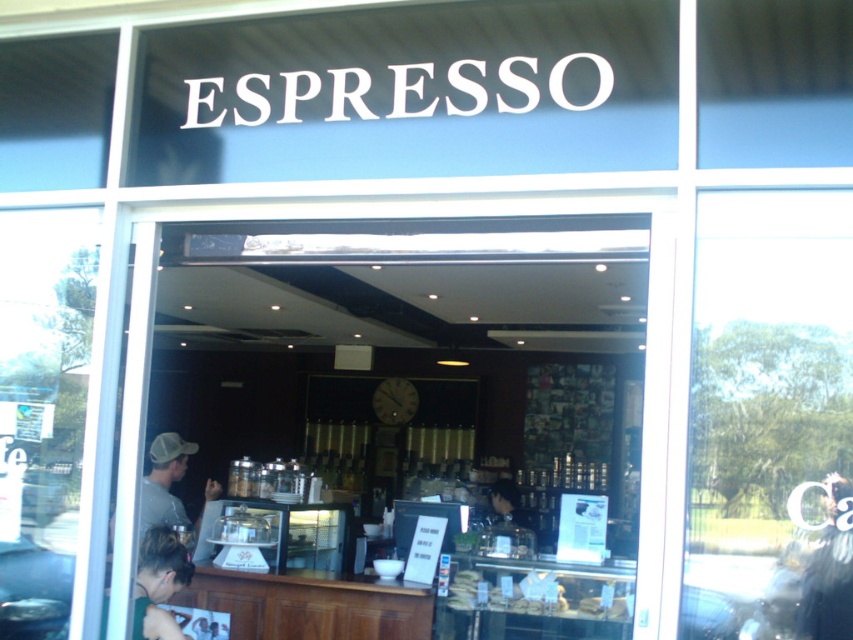
You are a customer entering the ESPRESSO cafe and want to order a coffee. You see the wooden counter at center and the blonde hair at lower left. Which object is wider from your perspective?

The wooden counter at center is wider than the blonde hair at lower left.

You are a customer waiting outside the ESPRESSO cafe. You see the transparent glass window at center and the blonde hair at lower left. Which object is closer to the right side of the entrance?

The transparent glass window at center is positioned on the right side of blonde hair at lower left, so it is closer to the right side of the entrance.